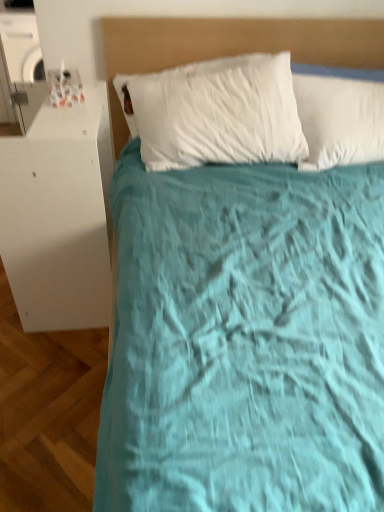
The image size is (384, 512). What do you see at coordinates (59, 215) in the screenshot? I see `white glossy cabinet at left` at bounding box center [59, 215].

Where is `white glossy cabinet at left`? white glossy cabinet at left is located at coordinates (59, 215).

In order to face white glossy cabinet at left, should I rotate leftwards or rightwards?

To face it directly, rotate left by 16.598 degrees.

This screenshot has width=384, height=512. What are the coordinates of `matte beige headboard at upper center` in the screenshot? It's located at (231, 46).

The height and width of the screenshot is (512, 384). Describe the element at coordinates (231, 46) in the screenshot. I see `matte beige headboard at upper center` at that location.

Locate an element on the screen. The width and height of the screenshot is (384, 512). white glossy cabinet at left is located at coordinates (x=59, y=215).

Which is more to the left, matte beige headboard at upper center or white glossy cabinet at left?

Positioned to the left is white glossy cabinet at left.

Is matte beige headboard at upper center closer to camera compared to white glossy cabinet at left?

That is False.

Which is behind, point (360, 24) or point (40, 281)?

The point (360, 24) is farther from the camera.

Looking at this image, from the image's perspective, does matte beige headboard at upper center appear higher than white glossy cabinet at left?

Yes, from the image's perspective, matte beige headboard at upper center is over white glossy cabinet at left.

From a real-world perspective, is matte beige headboard at upper center on top of white glossy cabinet at left?

Yes, from a real-world perspective, matte beige headboard at upper center is on top of white glossy cabinet at left.

Looking at their sizes, would you say matte beige headboard at upper center is wider or thinner than white glossy cabinet at left?

matte beige headboard at upper center is thinner than white glossy cabinet at left.

Between matte beige headboard at upper center and white glossy cabinet at left, which one has less height?

With less height is matte beige headboard at upper center.

Is matte beige headboard at upper center bigger than white glossy cabinet at left?

No, matte beige headboard at upper center is not bigger than white glossy cabinet at left.

Is matte beige headboard at upper center inside or outside of white glossy cabinet at left?

matte beige headboard at upper center lies outside white glossy cabinet at left.

Would you consider matte beige headboard at upper center to be distant from white glossy cabinet at left?

That's not correct — matte beige headboard at upper center is a little close to white glossy cabinet at left.

Is matte beige headboard at upper center looking in the opposite direction of white glossy cabinet at left?

No, matte beige headboard at upper center is not facing away from white glossy cabinet at left.

Can you tell me how much matte beige headboard at upper center and white glossy cabinet at left differ in facing direction?

There is a 85-degree angle between the facing directions of matte beige headboard at upper center and white glossy cabinet at left.

Image resolution: width=384 pixels, height=512 pixels. I want to click on table in front of the matte beige headboard at upper center, so click(x=59, y=215).

Based on their positions, is white glossy cabinet at left located to the left or right of matte beige headboard at upper center?

From the image, it's evident that white glossy cabinet at left is to the left of matte beige headboard at upper center.

Which object is closer to the camera taking this photo, white glossy cabinet at left or matte beige headboard at upper center?

white glossy cabinet at left is more forward.

Is point (83, 183) closer to viewer compared to point (152, 59)?

Yes, it is in front of point (152, 59).

From the image's perspective, which one is positioned lower, white glossy cabinet at left or matte beige headboard at upper center?

white glossy cabinet at left, from the image's perspective.

From a real-world perspective, who is located lower, white glossy cabinet at left or matte beige headboard at upper center?

white glossy cabinet at left is physically lower.

Is white glossy cabinet at left wider or thinner than matte beige headboard at upper center?

Considering their sizes, white glossy cabinet at left looks broader than matte beige headboard at upper center.

Is white glossy cabinet at left taller than matte beige headboard at upper center?

Indeed, white glossy cabinet at left has a greater height compared to matte beige headboard at upper center.

In the scene shown: Between white glossy cabinet at left and matte beige headboard at upper center, which one has smaller size?

Smaller between the two is matte beige headboard at upper center.

Which is correct: white glossy cabinet at left is inside matte beige headboard at upper center, or outside of it?

white glossy cabinet at left lies outside matte beige headboard at upper center.

Would you say white glossy cabinet at left is a long distance from matte beige headboard at upper center?

No, white glossy cabinet at left is not far away from matte beige headboard at upper center.

Is white glossy cabinet at left facing away from matte beige headboard at upper center?

Yes, white glossy cabinet at left is positioned with its back facing matte beige headboard at upper center.

Can you tell me how much white glossy cabinet at left and matte beige headboard at upper center differ in facing direction?

They differ by 85 degrees in their facing directions.

How much distance is there between white glossy cabinet at left and matte beige headboard at upper center?

They are 61.93 centimeters apart.

In the image, there is a matte beige headboard at upper center. Where is `table below it (from a real-world perspective)`? The image size is (384, 512). table below it (from a real-world perspective) is located at coordinates (59, 215).

Locate an element on the screen. Image resolution: width=384 pixels, height=512 pixels. table in front of the matte beige headboard at upper center is located at coordinates (59, 215).

Locate an element on the screen. Image resolution: width=384 pixels, height=512 pixels. headboard behind the white glossy cabinet at left is located at coordinates click(231, 46).